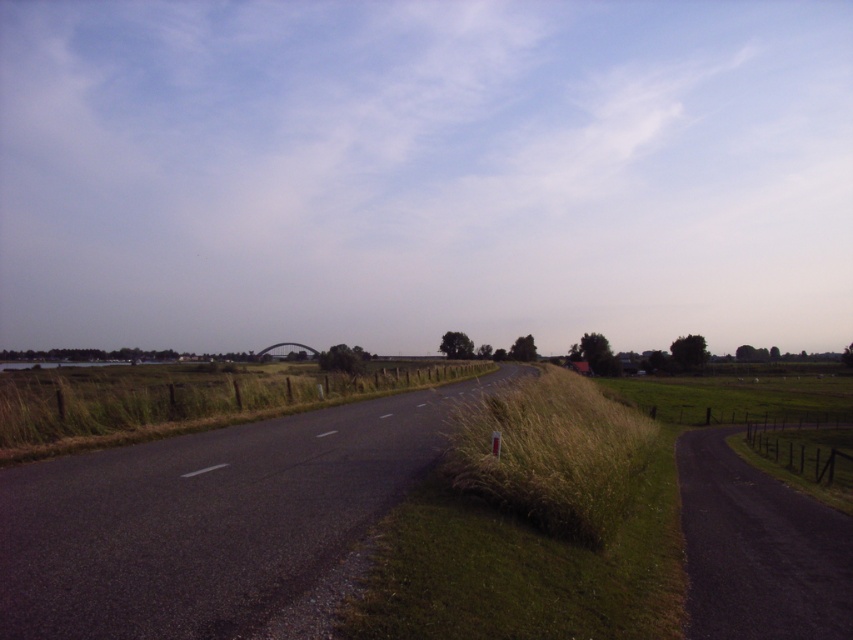
You are standing at the edge of the road and want to walk to the point marked as point (514, 512). Considering the road is 27.53 feet away from you, is this within a safe walking distance for a person?

The distance between you and point (514, 512) is 27.53 feet. This distance is within a safe walking range for a person, so it is safe to walk there.

You are standing at the edge of the road and want to walk towards the horizon. There are two points marked on the road surface. Which point, point (x=674, y=516) or point (x=96, y=442), would you reach first as you walk forward?

You would reach point (x=96, y=442) first because it is closer to you than point (x=674, y=516), which is further away.

You are standing on the rural road depicted in the scene and want to step onto the green grassy area at center. Given that your average stride length is about 2.5 feet, how many steps would it take you to reach the green grassy at center?

The distance between you and the green grassy at center is 15.57 feet. Dividing this by your stride length of 2.5 feet per step gives approximately 6.23 steps. Since you can only take whole steps, you would need to take 7 steps to reach the green grassy at center.